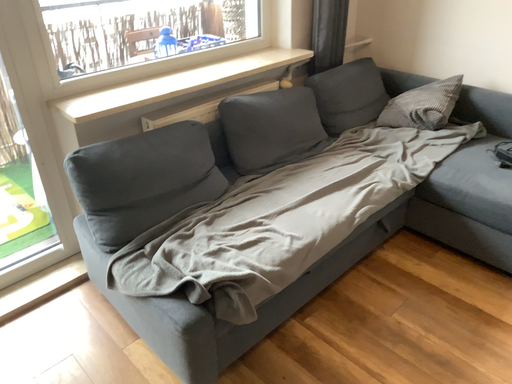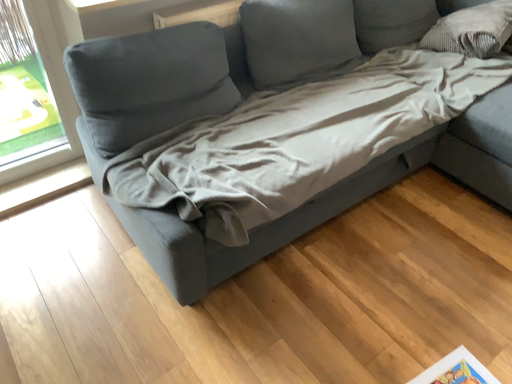
Question: Which way did the camera rotate in the video?

Choices:
 (A) rotated downward
 (B) rotated upward

Answer: (A)